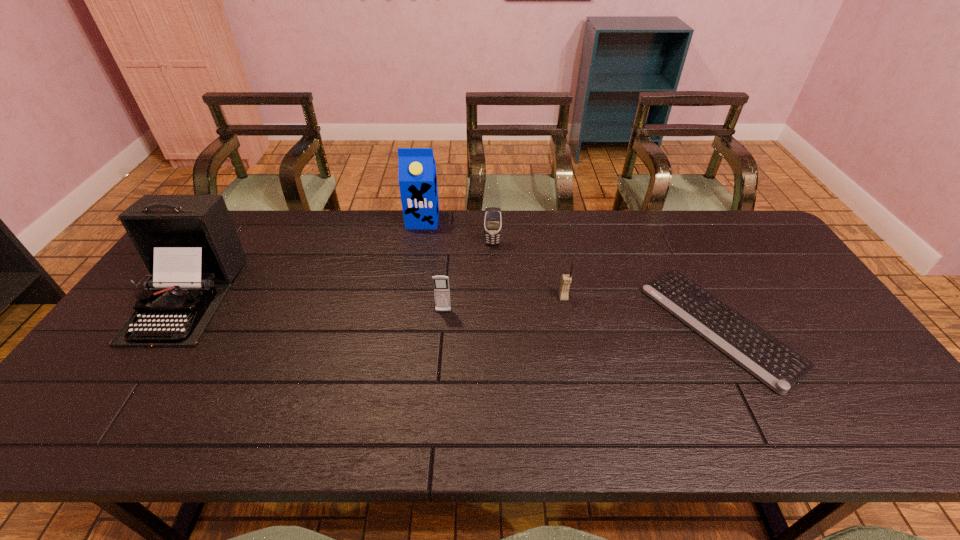
You are a GUI agent. You are given a task and a screenshot of the screen. Output one action in this format:
    pyautogui.click(x=<x>, y=<y>)
    Task: Click on the free point between the second cellular telephone from right to left and the second object from left to right
    The image size is (960, 540).
    Given the screenshot: What is the action you would take?
    pyautogui.click(x=458, y=232)

Select which object appears as the closest to the typewriter. Please provide its 2D coordinates. Your answer should be formatted as a tuple, i.e. [(x, y)], where the tuple contains the x and y coordinates of a point satisfying the conditions above.

[(417, 169)]

Identify which object is the second nearest to the second farthest object. Please provide its 2D coordinates. Your answer should be formatted as a tuple, i.e. [(x, y)], where the tuple contains the x and y coordinates of a point satisfying the conditions above.

[(566, 280)]

The image size is (960, 540). In order to click on cellular telephone that stands as the closest to the leftmost cellular telephone in this screenshot , I will do pos(492,216).

I want to click on cellular telephone that can be found as the closest to the farthest cellular telephone, so (x=566, y=280).

The height and width of the screenshot is (540, 960). In order to click on free space that satisfies the following two spatial constraints: 1. on the front face of the computer keyboard; 2. on the left side of the second cellular telephone from left to right in this screenshot , I will do `click(495, 327)`.